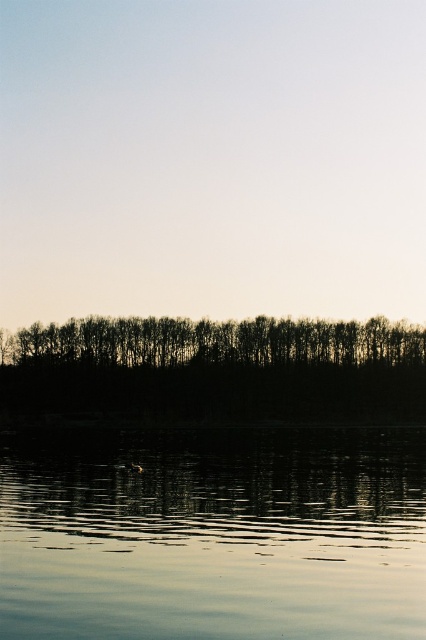
Question: Among these objects, which one is farthest from the camera?

Choices:
 (A) black silhouetted trees at center
 (B) smooth reflective water at bottom

Answer: (A)

Question: Among these points, which one is nearest to the camera?

Choices:
 (A) (411, 388)
 (B) (302, 600)

Answer: (B)

Question: Is smooth reflective water at bottom thinner than black silhouetted trees at center?

Choices:
 (A) yes
 (B) no

Answer: (A)

Question: Which point appears farthest from the camera in this image?

Choices:
 (A) (294, 413)
 (B) (51, 604)

Answer: (A)

Question: Does smooth reflective water at bottom have a larger size compared to black silhouetted trees at center?

Choices:
 (A) no
 (B) yes

Answer: (A)

Question: In this image, where is smooth reflective water at bottom located relative to black silhouetted trees at center?

Choices:
 (A) left
 (B) right

Answer: (B)